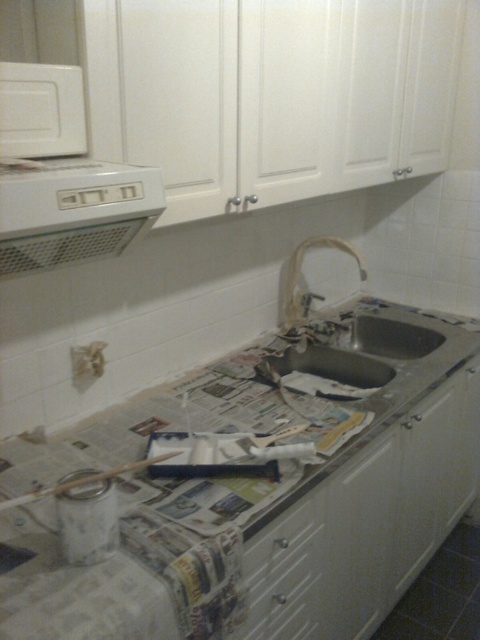
Question: Among these points, which one is nearest to the camera?

Choices:
 (A) (312, 518)
 (B) (389, 529)
 (C) (330, 362)
 (D) (72, 218)

Answer: (D)

Question: Can you confirm if white glossy drawer at lower center is positioned to the right of metallic sink at center?

Choices:
 (A) no
 (B) yes

Answer: (A)

Question: Estimate the real-world distances between objects in this image. Which object is farther from the white glossy drawer at lower center?

Choices:
 (A) white plastic exhaust hood at upper left
 (B) metallic sink at center

Answer: (A)

Question: Which object appears farthest from the camera in this image?

Choices:
 (A) white plastic exhaust hood at upper left
 (B) white glossy drawer at lower center
 (C) white glossy countertop at center
 (D) metallic sink at center

Answer: (D)

Question: Does white plastic exhaust hood at upper left appear over white glossy drawer at lower center?

Choices:
 (A) yes
 (B) no

Answer: (A)

Question: Can you confirm if white plastic exhaust hood at upper left is positioned to the right of white glossy drawer at lower center?

Choices:
 (A) no
 (B) yes

Answer: (A)